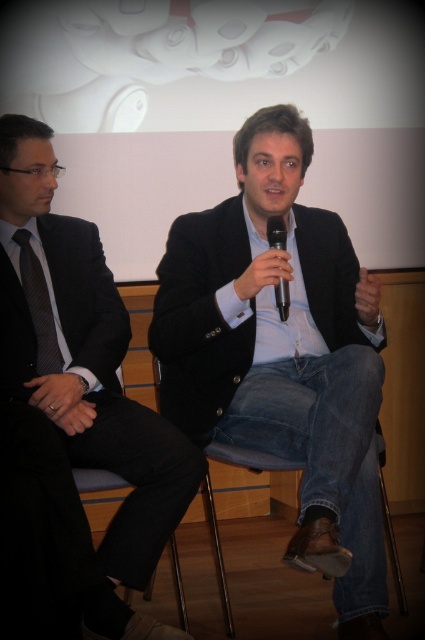
Is point (232, 397) positioned before point (22, 307)?

No, it is behind (22, 307).

Who is higher up, black matte suit at center or matte black suit at center?

matte black suit at center

Is point (234, 403) positioned in front of point (144, 628)?

No, it is behind (144, 628).

The height and width of the screenshot is (640, 425). What are the coordinates of `black matte suit at center` in the screenshot? It's located at (283, 355).

Which is in front, point (104, 339) or point (48, 292)?

Point (48, 292) is more forward.

Locate an element on the screen. The width and height of the screenshot is (425, 640). matte black suit at center is located at coordinates pyautogui.click(x=84, y=372).

The width and height of the screenshot is (425, 640). I want to click on matte black suit at center, so click(84, 372).

Between matte black suit at center and black plastic microphone at center, which one has less height?

black plastic microphone at center is shorter.

Describe the element at coordinates (84, 372) in the screenshot. I see `matte black suit at center` at that location.

Describe the element at coordinates (84, 372) in the screenshot. I see `matte black suit at center` at that location.

Find the location of a particular element. matte black suit at center is located at coordinates (84, 372).